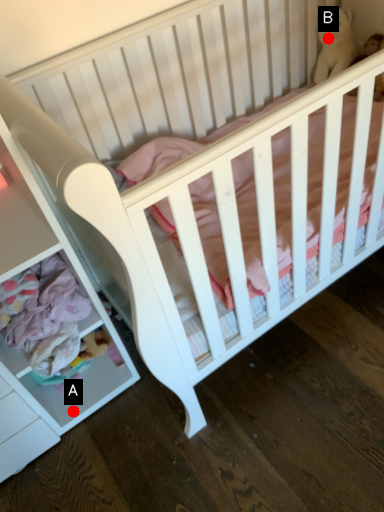
Question: Two points are circled on the image, labeled by A and B beside each circle. Which point is farther to the camera?

Choices:
 (A) A is further
 (B) B is further

Answer: (B)